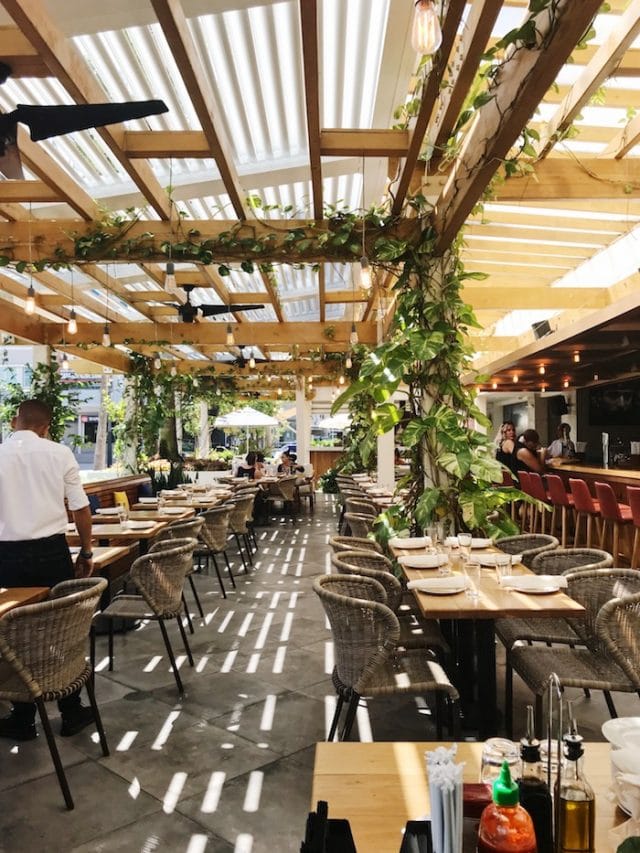
Find the location of a particular element. plant is located at coordinates (459, 426).